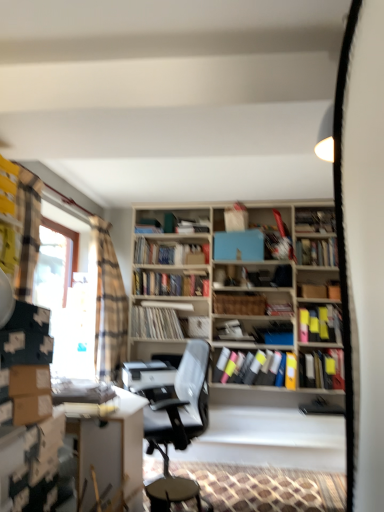
Question: Based on their sizes in the image, would you say plaid fabric curtain at left is bigger or smaller than gray fabric office chair at center?

Choices:
 (A) small
 (B) big

Answer: (B)

Question: Is plaid fabric curtain at left spatially inside gray fabric office chair at center, or outside of it?

Choices:
 (A) inside
 (B) outside

Answer: (B)

Question: Estimate the real-world distances between objects in this image. Which object is farther from the hardcover books at center, positioned as the 3th book in top-to-bottom order?

Choices:
 (A) wooden crate at center, which is the fourth book from top to bottom
 (B) matte black vinyl records at center, the 7th book in the top-to-bottom sequence
 (C) blue matte paperback book at center
 (D) matte plastic books at center, which ranks as the second book in bottom-to-top order
 (E) matte black book at center, marked as the 6th book in a bottom-to-top arrangement

Answer: (E)

Question: Based on their relative distances, which object is farther from the hardcover books at center, which ranks as the 8th book in bottom-to-top order?

Choices:
 (A) clear glass window at left
 (B) wooden crate at center, which is the fourth book from top to bottom
 (C) white glossy table at lower left
 (D) plaid fabric curtain at left
 (E) hardcover books at center, marked as the first book in a top-to-bottom arrangement

Answer: (C)